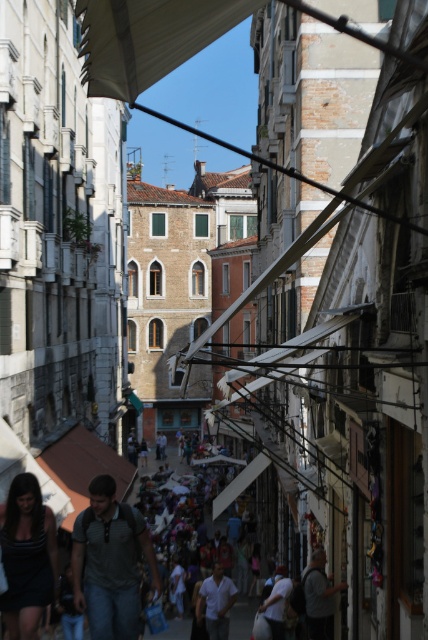
Question: Among these points, which one is farthest from the camera?

Choices:
 (A) [225, 634]
 (B) [157, 10]
 (C) [344, 588]
 (D) [89, 509]

Answer: (A)

Question: Is white fabric canopy at upper center wider than dark gray dress at lower left?

Choices:
 (A) yes
 (B) no

Answer: (A)

Question: Is denim jeans at center above dark gray dress at lower left?

Choices:
 (A) no
 (B) yes

Answer: (A)

Question: Which object is closer to the camera taking this photo?

Choices:
 (A) white matte shirt at center
 (B) dark gray dress at lower left
 (C) denim jeans at center
 (D) dark gray fabric at lower center

Answer: (B)

Question: Is the position of denim jeans at center less distant than that of dark gray dress at lower left?

Choices:
 (A) no
 (B) yes

Answer: (A)

Question: Which of the following is the farthest from the observer?

Choices:
 (A) (211, 637)
 (B) (121, 586)
 (C) (163, 16)
 (D) (311, 611)

Answer: (A)